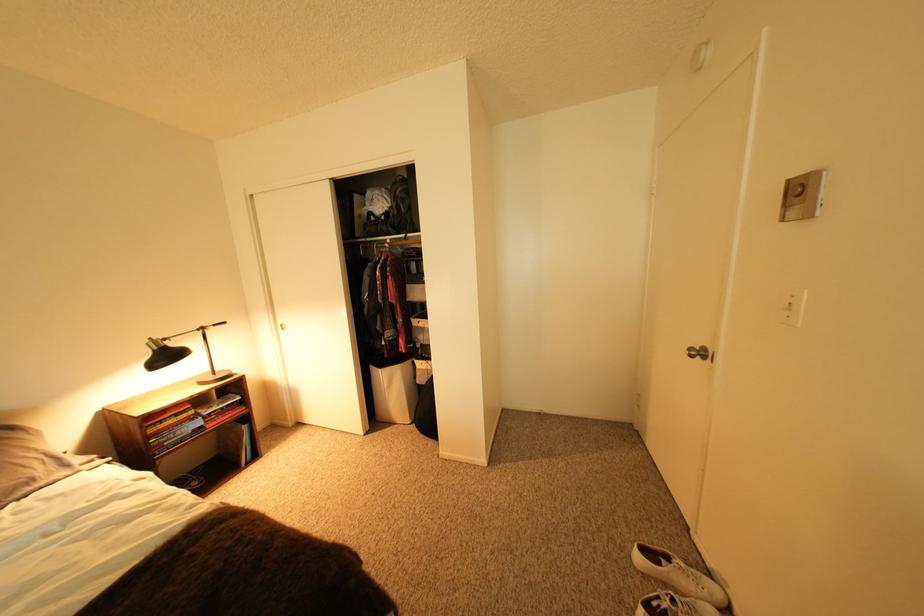
At what (x,y) coordinates should I click in order to perform the action: click on white shoe. Please return your answer as a coordinate pair (x, y). Looking at the image, I should click on coord(677,575).